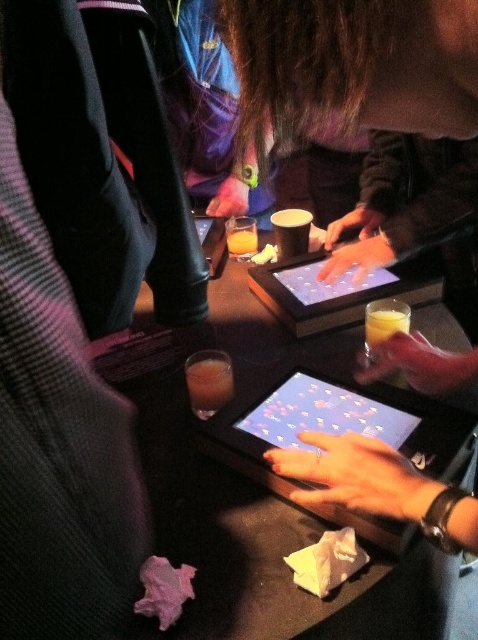
You are standing at the entrance of the room and want to locate the matte black tablet at center. According to the coordinates provided, where should you look relative to the room?

The matte black tablet at center is located at coordinates point 0.662 on the x axis and 0.701 on the y axis, so you should look towards the right side and upper middle area of the room to find it.

You are standing at the back of the room and want to reach the translucent glass at center. There is a translucent glass at lower right in your path. Which object do you need to move first?

You need to move the translucent glass at lower right first because it is below the translucent glass at center and blocking your path.